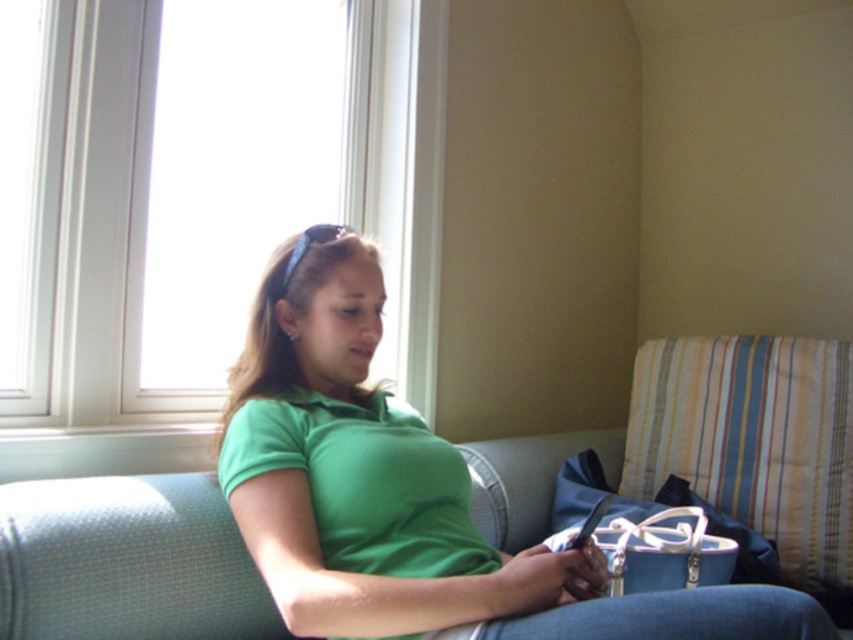
Between white plastic window at upper left and striped fabric pillow at right, which one has more height?

white plastic window at upper left

Is white plastic window at upper left further to the viewer compared to striped fabric pillow at right?

No, white plastic window at upper left is closer to the viewer.

Between point (194, 8) and point (842, 563), which one is positioned in front?

Positioned in front is point (842, 563).

Locate an element on the screen. white plastic window at upper left is located at coordinates (196, 192).

Consider the image. Does white plastic window at upper left appear under green matte shirt at center?

No, white plastic window at upper left is not below green matte shirt at center.

The image size is (853, 640). Identify the location of white plastic window at upper left. (196, 192).

Is point (358, 378) positioned in front of point (633, 460)?

Yes, point (358, 378) is closer to viewer.

Which is above, green matte shirt at center or striped fabric pillow at right?

Positioned higher is striped fabric pillow at right.

Identify the location of green matte shirt at center. This screenshot has width=853, height=640. (405, 493).